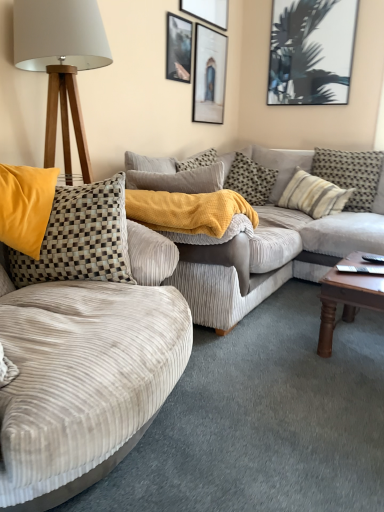
Question: From the image's perspective, is checkered fabric pillow at center, which is counted as the second pillow, starting from the left, above or below velvet beige couch at left, arranged as the first studio couch when viewed from the front?

Choices:
 (A) above
 (B) below

Answer: (A)

Question: Considering the positions of point (253, 202) and point (94, 422), is point (253, 202) closer or farther from the camera than point (94, 422)?

Choices:
 (A) farther
 (B) closer

Answer: (A)

Question: Estimate the real-world distances between objects in this image. Which object is farther from the striped fabric pillow at center, placed as the 4th pillow when sorted from left to right?

Choices:
 (A) matte black picture frame at upper right, the fourth picture frame from the left
 (B) striped fabric pillow at right, marked as the first pillow in a right-to-left arrangement
 (C) metallic silver picture frame at upper center, the fourth picture frame viewed from the right
 (D) checkered fabric pillow at center, which is counted as the second pillow, starting from the left
 (E) matte black picture frame at upper center, acting as the second picture frame starting from the left

Answer: (E)

Question: Which object is the farthest from the striped fabric pillow at center, placed as the 4th pillow when sorted from left to right?

Choices:
 (A) metallic silver picture frame at upper center, placed as the 1th picture frame when sorted from left to right
 (B) velvet beige couch at left, arranged as the first studio couch when viewed from the front
 (C) matte glass picture frame at upper center, the third picture frame positioned from the left
 (D) wooden tripod lamp at left
 (E) checkered fabric pillow at center, positioned as the fifth pillow in right-to-left order

Answer: (B)